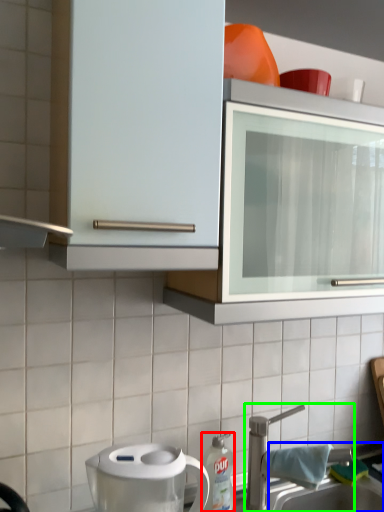
Question: Considering the real-world distances, which object is farthest from kitchen appliance (highlighted by a red box)? sink (highlighted by a blue box) or tap (highlighted by a green box)?

Choices:
 (A) sink
 (B) tap

Answer: (A)